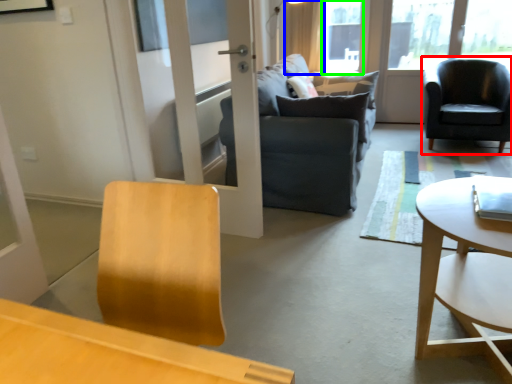
Question: Estimate the real-world distances between objects in this image. Which object is farther from chair (highlighted by a red box), curtain (highlighted by a blue box) or window screen (highlighted by a green box)?

Choices:
 (A) curtain
 (B) window screen

Answer: (A)